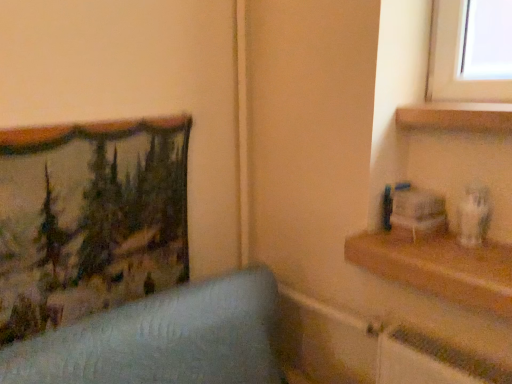
Identify the location of textured fabric picture frame at left. (89, 219).

Locate an element on the screen. Image resolution: width=512 pixels, height=384 pixels. textured fabric picture frame at left is located at coordinates (89, 219).

From a real-world perspective, is wooden shelf at right, which is the 1th shelf from bottom to top, located higher than textured fabric picture frame at left?

No, from a real-world perspective, wooden shelf at right, which is the 1th shelf from bottom to top, is not above textured fabric picture frame at left.

Which is behind, point (409, 268) or point (59, 318)?

The point (59, 318) is farther.

Which of these two, wooden shelf at right, which is the 1th shelf from bottom to top, or textured fabric picture frame at left, is thinner?

textured fabric picture frame at left is thinner.

Is wooden shelf at right, which is the 1th shelf from bottom to top, located outside textured fabric picture frame at left?

Yes.

Is wooden shelf at upper right, the 2th shelf when ordered from bottom to top, to the right of textured fabric picture frame at left from the viewer's perspective?

Indeed, wooden shelf at upper right, the 2th shelf when ordered from bottom to top, is positioned on the right side of textured fabric picture frame at left.

Which object is thinner, wooden shelf at upper right, arranged as the first shelf when viewed from the top, or textured fabric picture frame at left?

Thinner between the two is textured fabric picture frame at left.

Could you measure the distance between wooden shelf at upper right, arranged as the first shelf when viewed from the top, and textured fabric picture frame at left?

A distance of 37.03 inches exists between wooden shelf at upper right, arranged as the first shelf when viewed from the top, and textured fabric picture frame at left.

From a real-world perspective, is wooden shelf at upper right, the 2th shelf when ordered from bottom to top, above or below textured fabric picture frame at left?

Clearly, from a real-world perspective, wooden shelf at upper right, the 2th shelf when ordered from bottom to top, is above textured fabric picture frame at left.

From a real-world perspective, is textured fabric picture frame at left positioned above or below wooden shelf at upper right, arranged as the first shelf when viewed from the top?

textured fabric picture frame at left is below wooden shelf at upper right, arranged as the first shelf when viewed from the top.

Consider the image. Based on their positions, is textured fabric picture frame at left located to the left or right of wooden shelf at upper right, the 2th shelf when ordered from bottom to top?

Based on their positions, textured fabric picture frame at left is located to the left of wooden shelf at upper right, the 2th shelf when ordered from bottom to top.

Between textured fabric picture frame at left and wooden shelf at upper right, the 2th shelf when ordered from bottom to top, which one has smaller size?

Smaller between the two is wooden shelf at upper right, the 2th shelf when ordered from bottom to top.

Who is shorter, textured fabric picture frame at left or wooden shelf at upper right, the 2th shelf when ordered from bottom to top?

Standing shorter between the two is wooden shelf at upper right, the 2th shelf when ordered from bottom to top.

Based on the photo, can you confirm if wooden shelf at right, the second shelf when ordered from top to bottom, is bigger than wooden shelf at upper right, the 2th shelf when ordered from bottom to top?

Correct, wooden shelf at right, the second shelf when ordered from top to bottom, is larger in size than wooden shelf at upper right, the 2th shelf when ordered from bottom to top.

Considering the positions of objects wooden shelf at right, which is the 1th shelf from bottom to top, and wooden shelf at upper right, arranged as the first shelf when viewed from the top, in the image provided, who is behind, wooden shelf at right, which is the 1th shelf from bottom to top, or wooden shelf at upper right, arranged as the first shelf when viewed from the top,?

wooden shelf at upper right, arranged as the first shelf when viewed from the top.

Is point (439, 291) behind point (496, 114)?

No, it is in front of (496, 114).

Which object is wider, wooden shelf at right, the second shelf when ordered from top to bottom, or wooden shelf at upper right, the 2th shelf when ordered from bottom to top?

With larger width is wooden shelf at right, the second shelf when ordered from top to bottom.

Is textured fabric picture frame at left not near wooden shelf at right, which is the 1th shelf from bottom to top?

textured fabric picture frame at left is actually quite close to wooden shelf at right, which is the 1th shelf from bottom to top.

From a real-world perspective, is textured fabric picture frame at left physically located above or below wooden shelf at right, which is the 1th shelf from bottom to top?

In terms of real-world spatial position, textured fabric picture frame at left is above wooden shelf at right, which is the 1th shelf from bottom to top.

Is textured fabric picture frame at left inside the boundaries of wooden shelf at right, the second shelf when ordered from top to bottom, or outside?

textured fabric picture frame at left cannot be found inside wooden shelf at right, the second shelf when ordered from top to bottom.

How much distance is there between textured fabric picture frame at left and wooden shelf at right, which is the 1th shelf from bottom to top?

The distance of textured fabric picture frame at left from wooden shelf at right, which is the 1th shelf from bottom to top, is 31.32 inches.

Considering the sizes of objects wooden shelf at upper right, the 2th shelf when ordered from bottom to top, and wooden shelf at right, which is the 1th shelf from bottom to top, in the image provided, who is wider, wooden shelf at upper right, the 2th shelf when ordered from bottom to top, or wooden shelf at right, which is the 1th shelf from bottom to top,?

With larger width is wooden shelf at right, which is the 1th shelf from bottom to top.

In the scene shown: Is wooden shelf at upper right, arranged as the first shelf when viewed from the top, looking in the opposite direction of wooden shelf at right, which is the 1th shelf from bottom to top?

No, wooden shelf at upper right, arranged as the first shelf when viewed from the top, is not facing away from wooden shelf at right, which is the 1th shelf from bottom to top.

Is there a large distance between wooden shelf at upper right, the 2th shelf when ordered from bottom to top, and wooden shelf at right, which is the 1th shelf from bottom to top?

No.

Where is `shelf lying below the textured fabric picture frame at left (from the image's perspective)`? The width and height of the screenshot is (512, 384). shelf lying below the textured fabric picture frame at left (from the image's perspective) is located at coordinates (439, 268).

Where is `shelf above the textured fabric picture frame at left (from the image's perspective)`? shelf above the textured fabric picture frame at left (from the image's perspective) is located at coordinates (456, 117).

Looking at the image, which one is located closer to wooden shelf at upper right, arranged as the first shelf when viewed from the top, wooden shelf at right, the second shelf when ordered from top to bottom, or textured fabric picture frame at left?

Among the two, wooden shelf at right, the second shelf when ordered from top to bottom, is located nearer to wooden shelf at upper right, arranged as the first shelf when viewed from the top.

When comparing their distances from wooden shelf at right, which is the 1th shelf from bottom to top, does wooden shelf at upper right, arranged as the first shelf when viewed from the top, or textured fabric picture frame at left seem closer?

wooden shelf at upper right, arranged as the first shelf when viewed from the top.

From the image, which object appears to be farther from textured fabric picture frame at left, wooden shelf at right, which is the 1th shelf from bottom to top, or wooden shelf at upper right, arranged as the first shelf when viewed from the top?

wooden shelf at upper right, arranged as the first shelf when viewed from the top.

Looking at the image, which one is located further to wooden shelf at upper right, arranged as the first shelf when viewed from the top, textured fabric picture frame at left or wooden shelf at right, which is the 1th shelf from bottom to top?

textured fabric picture frame at left is further to wooden shelf at upper right, arranged as the first shelf when viewed from the top.

When comparing their distances from wooden shelf at right, the second shelf when ordered from top to bottom, does textured fabric picture frame at left or wooden shelf at upper right, the 2th shelf when ordered from bottom to top, seem further?

Based on the image, textured fabric picture frame at left appears to be further to wooden shelf at right, the second shelf when ordered from top to bottom.

Estimate the real-world distances between objects in this image. Which object is further from textured fabric picture frame at left, wooden shelf at upper right, the 2th shelf when ordered from bottom to top, or wooden shelf at right, which is the 1th shelf from bottom to top?

Among the two, wooden shelf at upper right, the 2th shelf when ordered from bottom to top, is located further to textured fabric picture frame at left.

Where is `shelf between textured fabric picture frame at left and wooden shelf at upper right, the 2th shelf when ordered from bottom to top, in the horizontal direction`? The width and height of the screenshot is (512, 384). shelf between textured fabric picture frame at left and wooden shelf at upper right, the 2th shelf when ordered from bottom to top, in the horizontal direction is located at coordinates (439, 268).